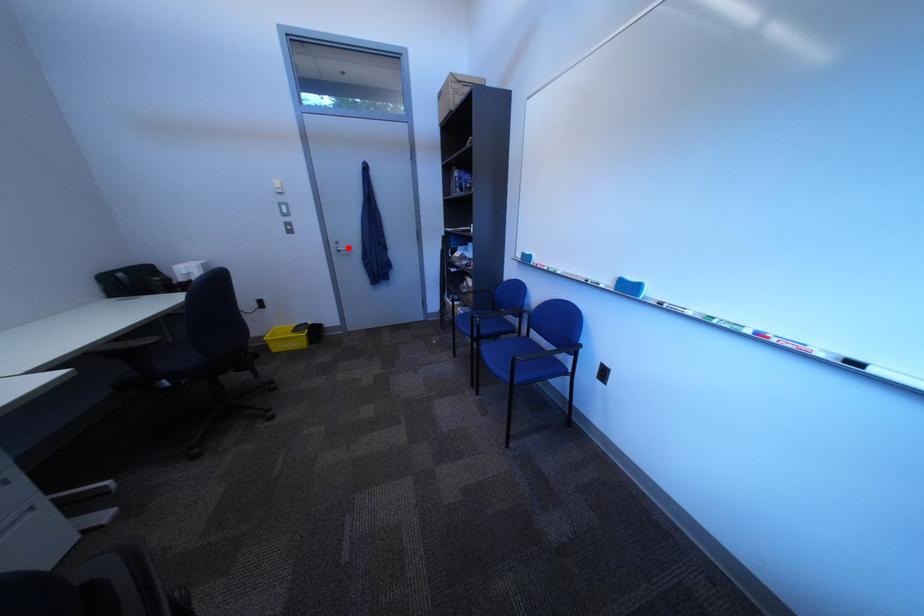
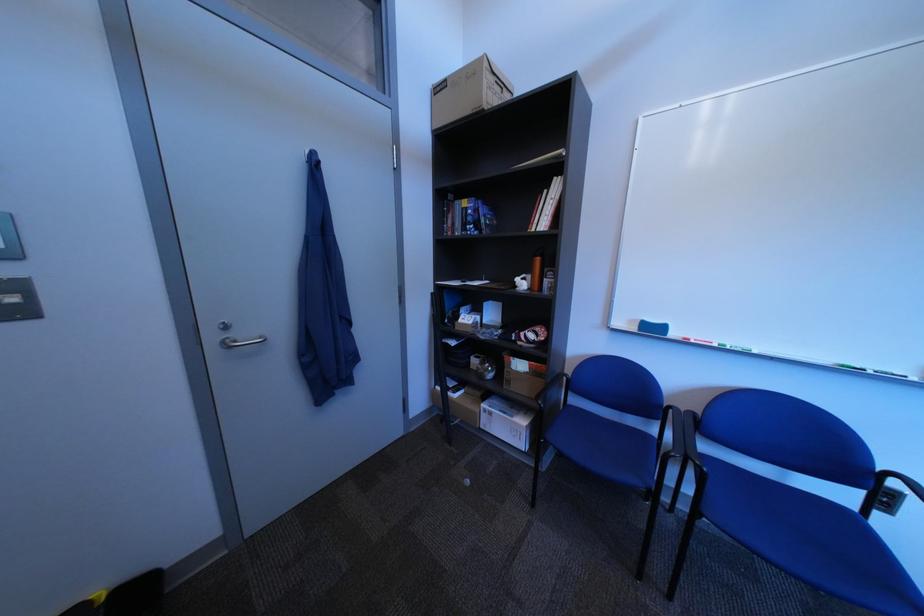
Question: I am providing you with two images of the same scene from different viewpoints. In image1, a red point is highlighted. Considering the same 3D point in image2, which of the following is correct?

Choices:
 (A) It is closer
 (B) It is farther

Answer: (B)